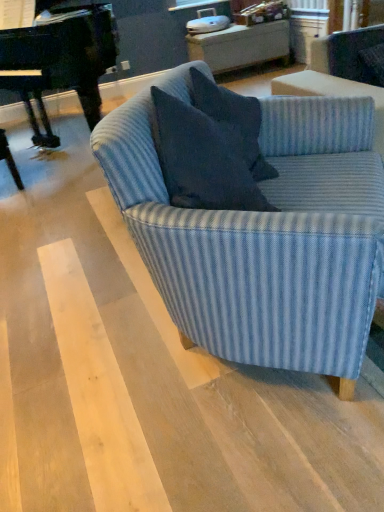
Question: From the image's perspective, is blue striped fabric couch at center under dark blue fabric pillow at center?

Choices:
 (A) yes
 (B) no

Answer: (A)

Question: Can you confirm if blue striped fabric couch at center is taller than dark blue fabric pillow at center?

Choices:
 (A) no
 (B) yes

Answer: (B)

Question: Can you confirm if blue striped fabric couch at center is wider than dark blue fabric pillow at center?

Choices:
 (A) no
 (B) yes

Answer: (B)

Question: Could you tell me if blue striped fabric couch at center is turned towards dark blue fabric pillow at center?

Choices:
 (A) yes
 (B) no

Answer: (A)

Question: Is dark blue fabric pillow at center surrounded by blue striped fabric couch at center?

Choices:
 (A) no
 (B) yes

Answer: (B)

Question: In terms of height, does blue striped fabric couch at center look taller or shorter compared to dark blue fabric pillow at center?

Choices:
 (A) short
 (B) tall

Answer: (B)

Question: From the image's perspective, relative to dark blue fabric pillow at center, is blue striped fabric couch at center above or below?

Choices:
 (A) above
 (B) below

Answer: (B)

Question: Does point (216, 275) appear closer or farther from the camera than point (243, 148)?

Choices:
 (A) closer
 (B) farther

Answer: (A)

Question: In the image, is blue striped fabric couch at center on the left side or the right side of dark blue fabric pillow at center?

Choices:
 (A) left
 (B) right

Answer: (B)

Question: From the image's perspective, is blue striped fabric couch at center above or below black polished piano at left?

Choices:
 (A) below
 (B) above

Answer: (A)

Question: From a real-world perspective, is blue striped fabric couch at center physically located above or below black polished piano at left?

Choices:
 (A) below
 (B) above

Answer: (A)

Question: Based on their sizes in the image, would you say blue striped fabric couch at center is bigger or smaller than black polished piano at left?

Choices:
 (A) big
 (B) small

Answer: (B)

Question: Is blue striped fabric couch at center spatially inside black polished piano at left, or outside of it?

Choices:
 (A) inside
 (B) outside

Answer: (B)

Question: Considering the positions of dark blue fabric pillow at center and black polished piano at left in the image, is dark blue fabric pillow at center bigger or smaller than black polished piano at left?

Choices:
 (A) big
 (B) small

Answer: (B)

Question: In the image, is dark blue fabric pillow at center positioned in front of or behind black polished piano at left?

Choices:
 (A) front
 (B) behind

Answer: (A)